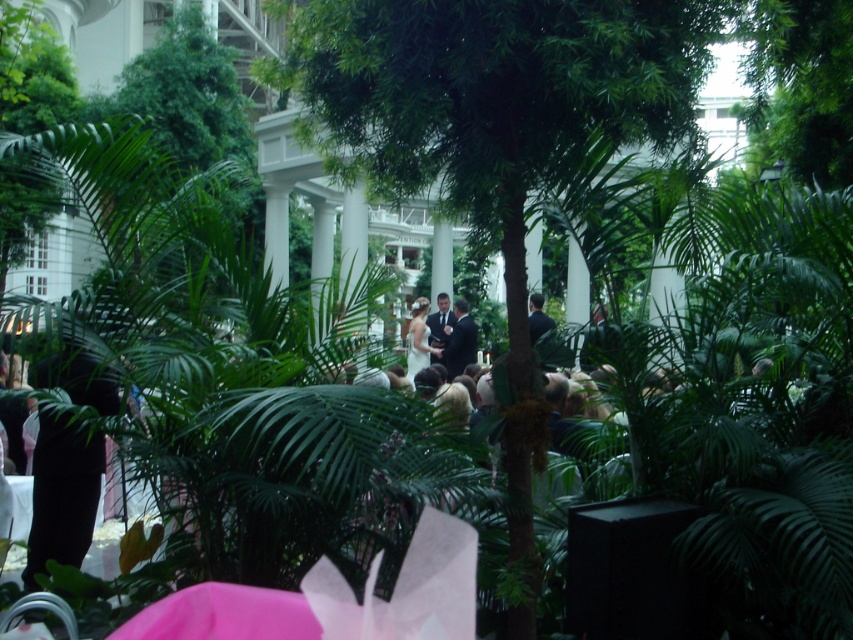
Based on the photo, you are a photographer at an outdoor tropical wedding. You need to capture a photo of the dark suit at center and white satin dress at center. Which one should you focus on first if you want to ensure both are in frame but prioritize the taller subject?

You should focus on the dark suit at center first since it is much taller than the white satin dress at center, ensuring its full height is captured while still including the white satin dress at center in the frame.